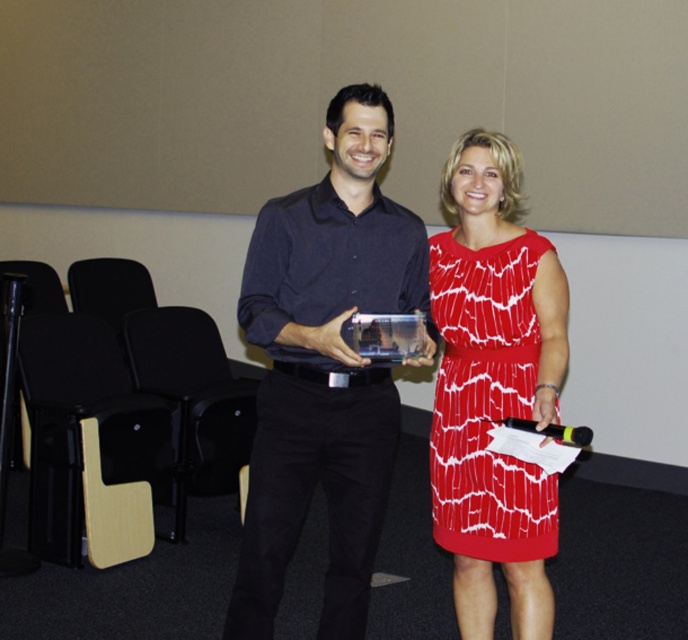
Question: Among these objects, which one is nearest to the camera?

Choices:
 (A) matte black shirt at center
 (B) red printed dress at center

Answer: (A)

Question: Does matte black shirt at center lie behind red printed dress at center?

Choices:
 (A) no
 (B) yes

Answer: (A)

Question: Which point is farther to the camera?

Choices:
 (A) matte black shirt at center
 (B) red printed dress at center

Answer: (B)

Question: Is matte black shirt at center smaller than red printed dress at center?

Choices:
 (A) yes
 (B) no

Answer: (B)

Question: Can you confirm if matte black shirt at center is wider than red printed dress at center?

Choices:
 (A) yes
 (B) no

Answer: (A)

Question: Which point is farther to the camera?

Choices:
 (A) matte black shirt at center
 (B) red printed dress at center

Answer: (B)